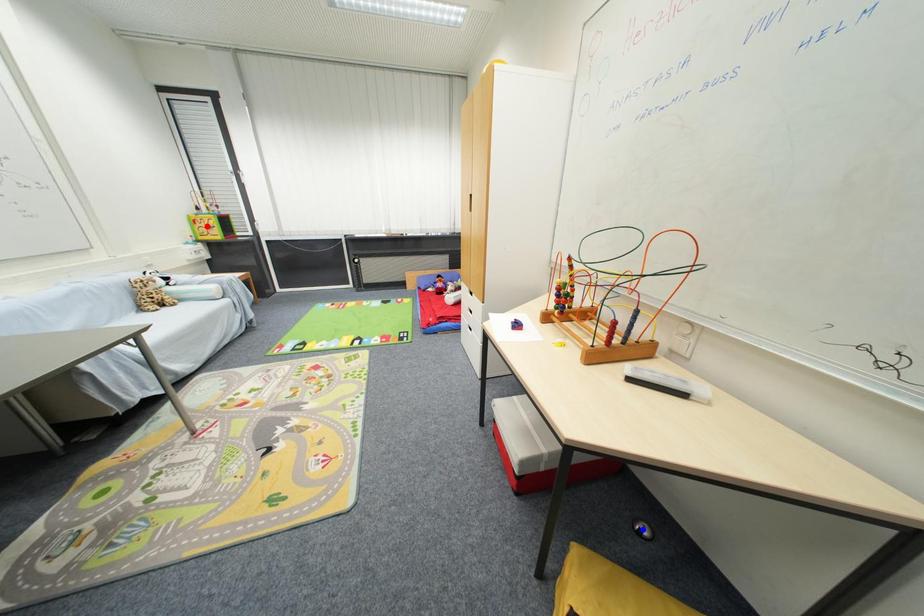
Question: Which of the two points in the image is closer to the camera?

Choices:
 (A) Blue point is closer.
 (B) Red point is closer.

Answer: (A)